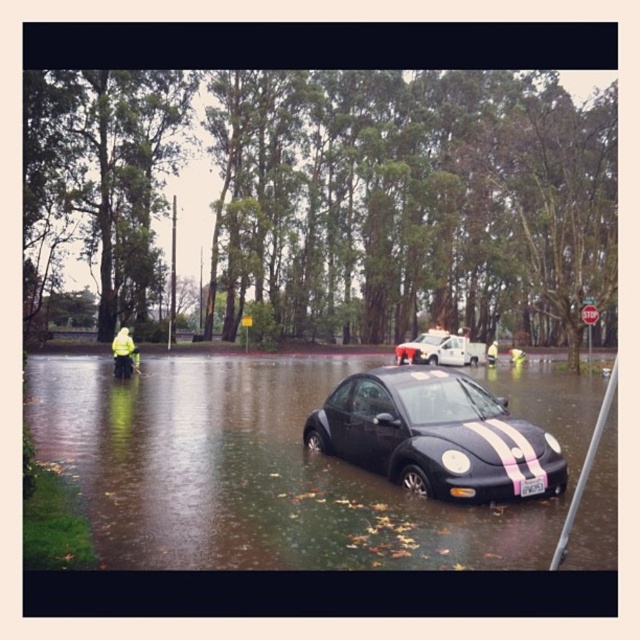
Does shiny black car at center come in front of yellow reflective jacket at center?

Yes, shiny black car at center is in front of yellow reflective jacket at center.

Does shiny black car at center appear on the right side of yellow reflective jacket at center?

No, shiny black car at center is not to the right of yellow reflective jacket at center.

Where is `shiny black car at center`? shiny black car at center is located at coordinates (433, 435).

Who is lower down, glossy black car at center or black plastic license plate at center?

black plastic license plate at center is lower down.

Is point (445, 333) less distant than point (532, 483)?

No, (445, 333) is behind (532, 483).

Which is behind, point (422, 340) or point (532, 483)?

The point (422, 340) is more distant.

Identify the location of glossy black car at center. (426, 348).

What do you see at coordinates (532, 486) in the screenshot? I see `black plastic license plate at center` at bounding box center [532, 486].

I want to click on black plastic license plate at center, so click(x=532, y=486).

Image resolution: width=640 pixels, height=640 pixels. What are the coordinates of `black plastic license plate at center` in the screenshot? It's located at (532, 486).